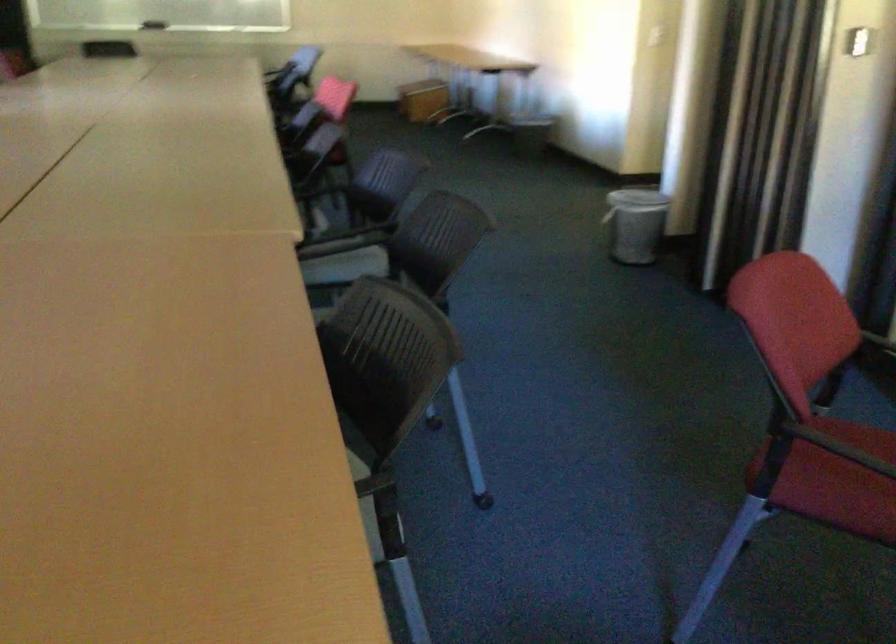
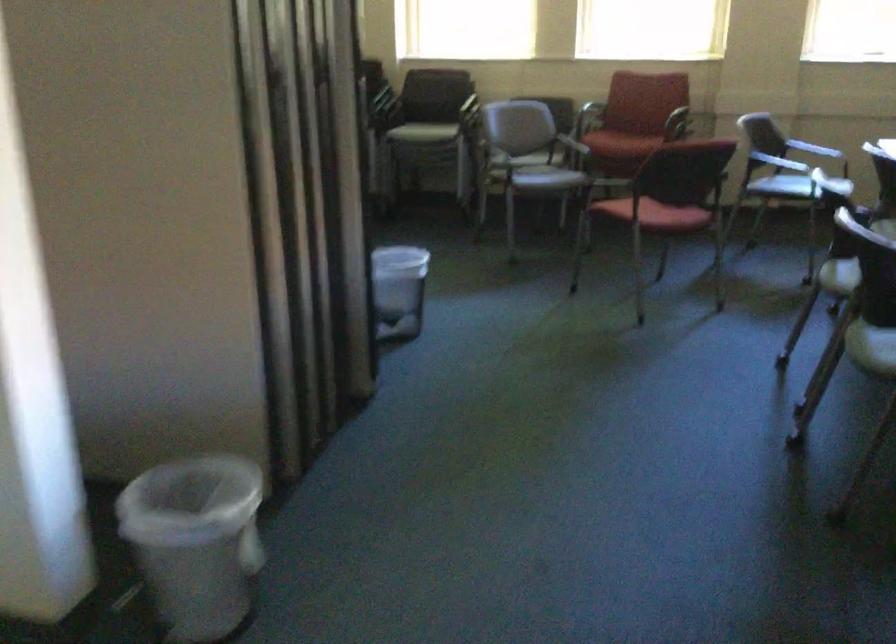
In the second image, find the point that corresponds to point (640, 194) in the first image.

(195, 542)